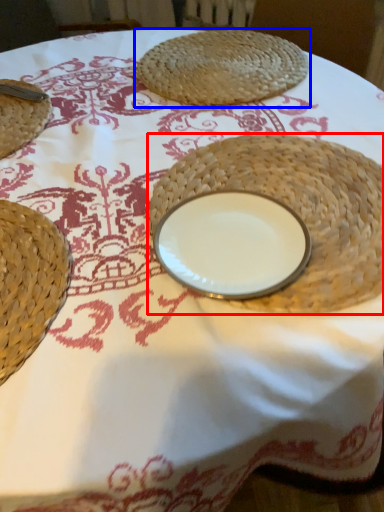
Question: Which of the following is the farthest to the observer, straw hat (highlighted by a red box) or food (highlighted by a blue box)?

Choices:
 (A) straw hat
 (B) food

Answer: (B)